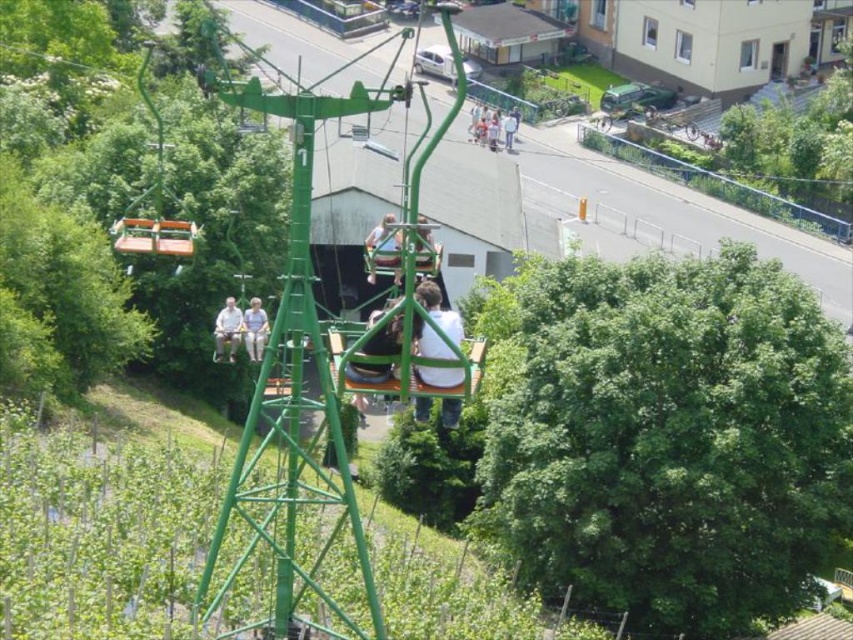
Question: Which object is the closest to the light blue shirt at center?

Choices:
 (A) white matte shirt at center
 (B) light brown leather jacket at lower left

Answer: (B)

Question: Considering the real-world distances, which object is closest to the green metallic cable car at center?

Choices:
 (A) light gray fabric pants at center
 (B) matte green chair at center

Answer: (B)

Question: Is light gray fabric pants at center behind light blue shirt at center?

Choices:
 (A) yes
 (B) no

Answer: (B)

Question: Which point is farther to the camera?

Choices:
 (A) [x=613, y=84]
 (B) [x=451, y=420]
 (C) [x=376, y=250]

Answer: (A)

Question: Is light gray fabric pants at center thinner than light blue shirt at center?

Choices:
 (A) yes
 (B) no

Answer: (B)

Question: Does matte green chair at center have a lesser width compared to light blue shirt at center?

Choices:
 (A) yes
 (B) no

Answer: (B)